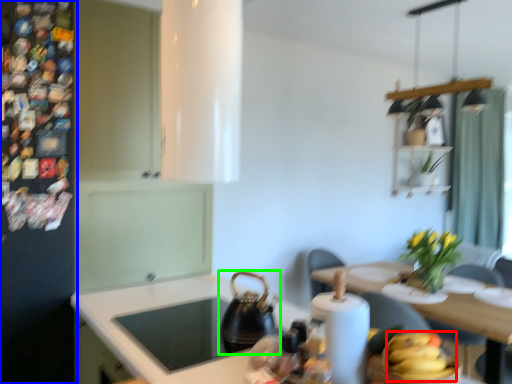
Question: Considering the real-world distances, which object is farthest from banana (highlighted by a red box)? fridge (highlighted by a blue box) or tea pot (highlighted by a green box)?

Choices:
 (A) fridge
 (B) tea pot

Answer: (A)